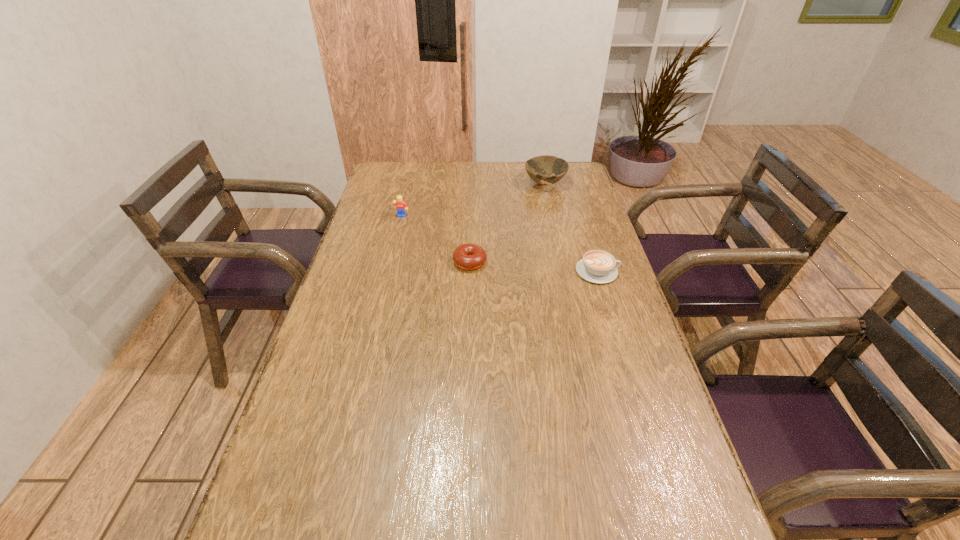
Find the location of `empty location between the leftmost object and the second object from left to right`. empty location between the leftmost object and the second object from left to right is located at coordinates [436, 240].

At what (x,y) coordinates should I click in order to perform the action: click on free space between the bowl and the Lego. Please return your answer as a coordinate pair (x, y). This screenshot has width=960, height=540. Looking at the image, I should click on (473, 201).

This screenshot has width=960, height=540. Find the location of `free point between the cappuccino and the bowl`. free point between the cappuccino and the bowl is located at coordinates (571, 228).

At what (x,y) coordinates should I click in order to perform the action: click on free spot between the doughnut and the cappuccino. Please return your answer as a coordinate pair (x, y). Image resolution: width=960 pixels, height=540 pixels. Looking at the image, I should click on (534, 267).

Find the location of a particular element. empty space between the second object from left to right and the bowl is located at coordinates (507, 224).

At what (x,y) coordinates should I click in order to perform the action: click on free point between the third object from right to left and the bowl. Please return your answer as a coordinate pair (x, y). Looking at the image, I should click on (507, 224).

Identify the location of free space between the Lego and the cappuccino. The height and width of the screenshot is (540, 960). (500, 244).

Select which object is the third closest to the cappuccino. Please provide its 2D coordinates. Your answer should be formatted as a tuple, i.e. [(x, y)], where the tuple contains the x and y coordinates of a point satisfying the conditions above.

[(401, 206)]

Find the location of `the second closest object to the cappuccino`. the second closest object to the cappuccino is located at coordinates (538, 168).

What are the coordinates of `free space that satisfies the following two spatial constraints: 1. on the face of the leftmost object; 2. on the right side of the second object from left to right` in the screenshot? It's located at (391, 262).